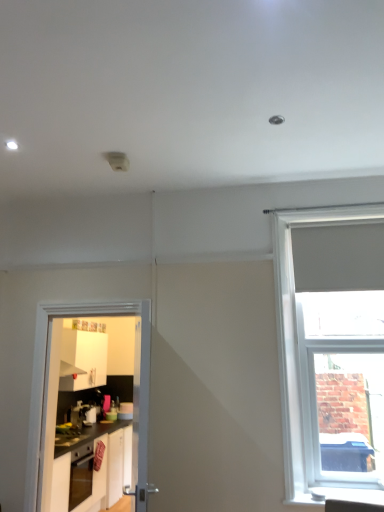
Question: Does satin silver coffee machine at left have a lesser height compared to white glossy door at left?

Choices:
 (A) yes
 (B) no

Answer: (A)

Question: Is satin silver coffee machine at left further to the viewer compared to white glossy door at left?

Choices:
 (A) yes
 (B) no

Answer: (A)

Question: From the image's perspective, is satin silver coffee machine at left over white glossy door at left?

Choices:
 (A) yes
 (B) no

Answer: (B)

Question: Is satin silver coffee machine at left thinner than white glossy door at left?

Choices:
 (A) no
 (B) yes

Answer: (A)

Question: Is satin silver coffee machine at left turned away from white glossy door at left?

Choices:
 (A) no
 (B) yes

Answer: (A)

Question: Considering the relative positions of satin silver coffee machine at left and white glossy door at left in the image provided, is satin silver coffee machine at left in front of white glossy door at left?

Choices:
 (A) no
 (B) yes

Answer: (A)

Question: Considering the relative sizes of white glossy cabinets at lower left and white matte window at right in the image provided, is white glossy cabinets at lower left taller than white matte window at right?

Choices:
 (A) no
 (B) yes

Answer: (A)

Question: Is white matte window at right a part of white glossy cabinets at lower left?

Choices:
 (A) no
 (B) yes

Answer: (A)

Question: Can you confirm if white glossy cabinets at lower left is positioned to the right of white matte window at right?

Choices:
 (A) yes
 (B) no

Answer: (B)

Question: Is white glossy cabinets at lower left thinner than white matte window at right?

Choices:
 (A) yes
 (B) no

Answer: (B)

Question: From a real-world perspective, is white glossy cabinets at lower left physically below white matte window at right?

Choices:
 (A) yes
 (B) no

Answer: (A)

Question: From the image's perspective, is white glossy cabinets at lower left below white matte window at right?

Choices:
 (A) yes
 (B) no

Answer: (A)

Question: Is white glossy cabinets at lower left looking in the opposite direction of white smooth window sill at lower right?

Choices:
 (A) no
 (B) yes

Answer: (A)